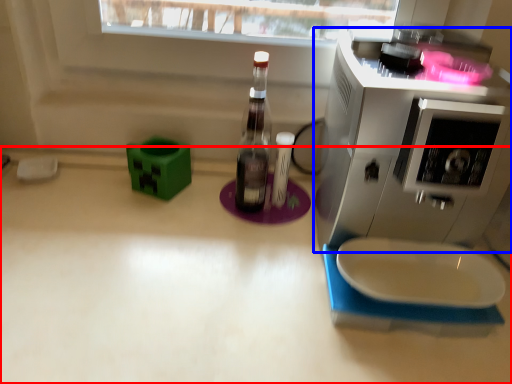
Question: Which object is further to the camera taking this photo, countertop (highlighted by a red box) or home appliance (highlighted by a blue box)?

Choices:
 (A) countertop
 (B) home appliance

Answer: (A)